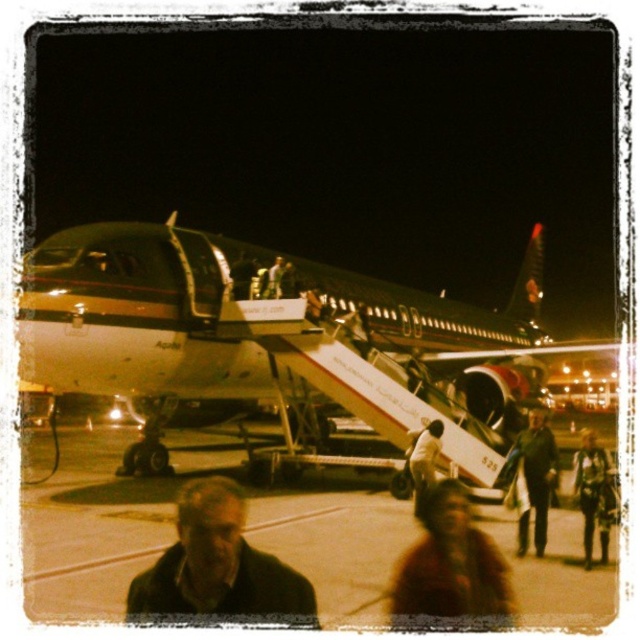
Which is above, dark brown leather jacket at lower center or dark brown leather jacket at lower right?

dark brown leather jacket at lower center

Is dark brown leather jacket at lower center shorter than dark brown leather jacket at lower right?

Yes.

The width and height of the screenshot is (640, 640). What do you see at coordinates (218, 566) in the screenshot? I see `dark brown leather jacket at lower center` at bounding box center [218, 566].

This screenshot has width=640, height=640. In order to click on dark brown leather jacket at lower center in this screenshot , I will do `click(218, 566)`.

Can you confirm if dark brown leather jacket at lower center is positioned below brown fuzzy coat at lower center?

Incorrect, dark brown leather jacket at lower center is not positioned below brown fuzzy coat at lower center.

Between point (195, 586) and point (451, 493), which one is positioned behind?

Positioned behind is point (451, 493).

Who is more forward, [259,596] or [484,563]?

Positioned in front is point [259,596].

This screenshot has width=640, height=640. Find the location of `dark brown leather jacket at lower center`. dark brown leather jacket at lower center is located at coordinates (218, 566).

Can you confirm if white metallic airplane at center is smaller than smooth concrete tarmac at center?

Actually, white metallic airplane at center might be larger than smooth concrete tarmac at center.

Is point (188, 304) positioned in front of point (147, 481)?

No.

Identify the location of white metallic airplane at center. pos(289,337).